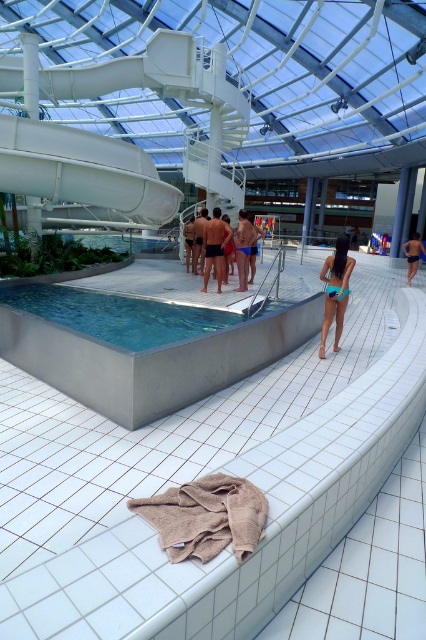
Question: Is metallic gray pool at center above dark blue swimsuit at center?

Choices:
 (A) yes
 (B) no

Answer: (B)

Question: Which object is farther from the camera taking this photo?

Choices:
 (A) teal fabric bikini at center
 (B) smooth blue skin at center

Answer: (B)

Question: Where is black matte shorts at center located in relation to dark blue shorts at center in the image?

Choices:
 (A) above
 (B) below

Answer: (B)

Question: Can you confirm if teal fabric bikini at center is positioned to the right of dark blue swimsuit at center?

Choices:
 (A) no
 (B) yes

Answer: (B)

Question: Which of the following is the farthest from the observer?

Choices:
 (A) (218, 244)
 (B) (187, 224)
 (C) (425, 248)
 (D) (245, 266)

Answer: (C)

Question: Which point is farther from the camera taking this photo?

Choices:
 (A) (241, 291)
 (B) (215, 227)

Answer: (A)